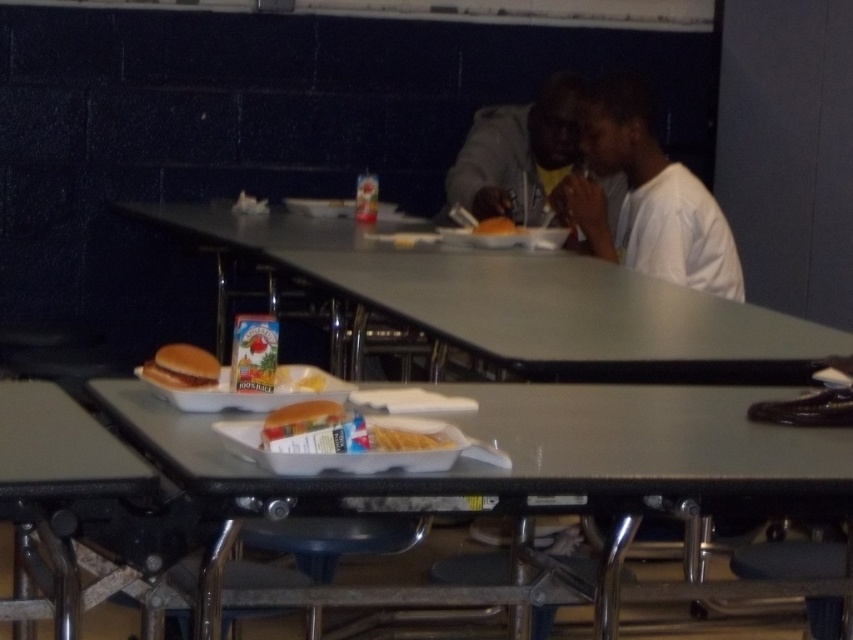
Does white matte shirt at upper right come behind dark gray hoodie at upper right?

No, it is in front of dark gray hoodie at upper right.

Image resolution: width=853 pixels, height=640 pixels. What do you see at coordinates (647, 196) in the screenshot?
I see `white matte shirt at upper right` at bounding box center [647, 196].

Identify the location of white matte shirt at upper right. (647, 196).

Is white paper tray at center closer to the viewer compared to white paper plate at upper center?

That is True.

The height and width of the screenshot is (640, 853). I want to click on white paper tray at center, so click(x=405, y=440).

What are the coordinates of `white paper tray at center` in the screenshot? It's located at (405, 440).

Does dark gray hoodie at upper right have a smaller size compared to white paper tray at center?

Incorrect, dark gray hoodie at upper right is not smaller in size than white paper tray at center.

Image resolution: width=853 pixels, height=640 pixels. I want to click on dark gray hoodie at upper right, so click(517, 154).